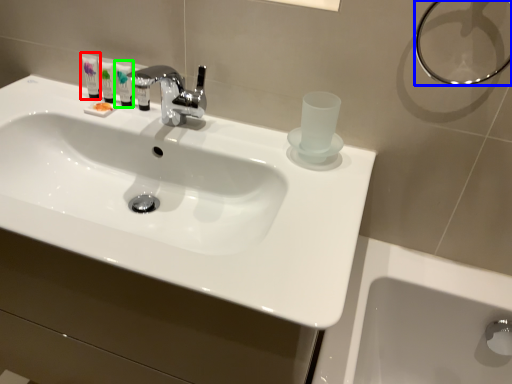
Question: Which object is positioned farthest from mouthwash (highlighted by a red box)? Select from shower (highlighted by a blue box) and mouthwash (highlighted by a green box).

Choices:
 (A) shower
 (B) mouthwash

Answer: (A)